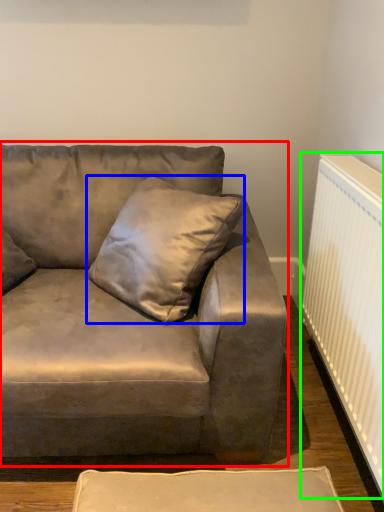
Question: Which object is positioned farthest from studio couch (highlighted by a red box)? Select from pillow (highlighted by a blue box) and radiator (highlighted by a green box).

Choices:
 (A) pillow
 (B) radiator

Answer: (B)